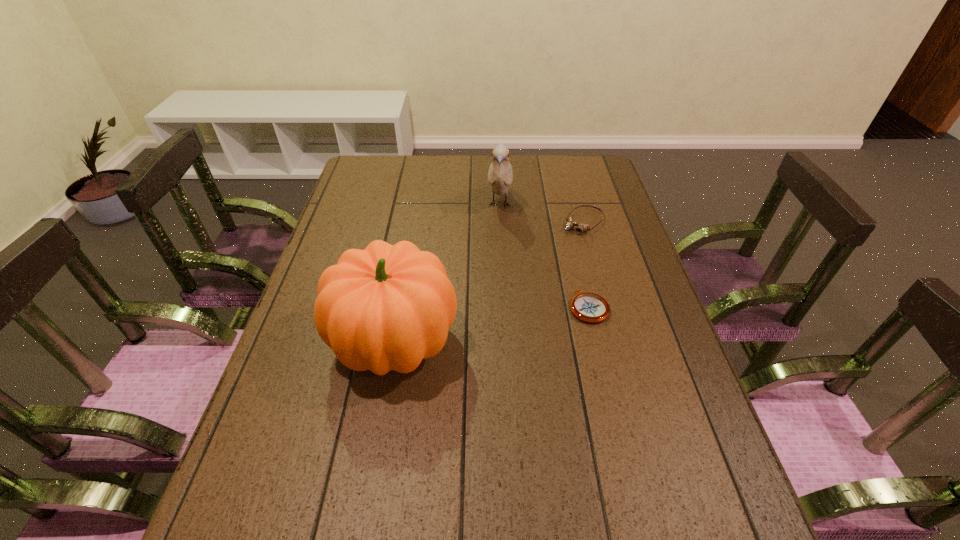
Find the location of a particular element. This screenshot has width=960, height=540. free region located 0.070m at the beak of the third object from right to left is located at coordinates (498, 239).

Where is `free spot located at the beak of the third object from right to left`? The image size is (960, 540). free spot located at the beak of the third object from right to left is located at coordinates (494, 277).

At what (x,y) coordinates should I click in order to perform the action: click on object located in the far edge section of the desktop. Please return your answer as a coordinate pair (x, y). The width and height of the screenshot is (960, 540). Looking at the image, I should click on (500, 175).

Identify the location of object that is positioned at the left edge. (387, 307).

Where is `compass located in the right edge section of the desktop`? Image resolution: width=960 pixels, height=540 pixels. compass located in the right edge section of the desktop is located at coordinates (590, 307).

Identify the location of goggles located at the right edge. The image size is (960, 540). (570, 224).

In the image, there is a desktop. Where is `vacant space at the far edge`? The width and height of the screenshot is (960, 540). vacant space at the far edge is located at coordinates (470, 168).

In the image, there is a desktop. Where is `vacant space at the left edge`? The image size is (960, 540). vacant space at the left edge is located at coordinates (310, 390).

Locate an element on the screen. The height and width of the screenshot is (540, 960). vacant space at the right edge of the desktop is located at coordinates (651, 315).

Identify the location of free region at the far left corner of the desktop. The height and width of the screenshot is (540, 960). [x=372, y=182].